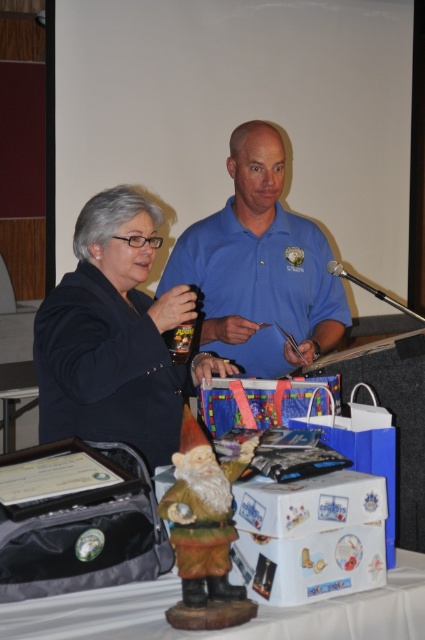
Who is positioned more to the left, matte black jacket at center or wooden gnome at center?

From the viewer's perspective, matte black jacket at center appears more on the left side.

Is point (166, 310) farther from viewer compared to point (274, 614)?

Yes, it is.

Find the location of a particular element. Image resolution: width=425 pixels, height=640 pixels. matte black jacket at center is located at coordinates (116, 337).

Does matte black jacket at center have a smaller size compared to polished wood gnome at center?

No, matte black jacket at center is not smaller than polished wood gnome at center.

Which of these two, matte black jacket at center or polished wood gnome at center, stands taller?

Standing taller between the two is matte black jacket at center.

Where is `matte black jacket at center`? matte black jacket at center is located at coordinates (116, 337).

Who is lower down, matte black jacket at center or blue cotton shirt at center?

matte black jacket at center is lower down.

Is point (138, 355) positioned after point (314, 285)?

No, it is in front of (314, 285).

This screenshot has height=640, width=425. Find the location of `matte black jacket at center`. matte black jacket at center is located at coordinates (116, 337).